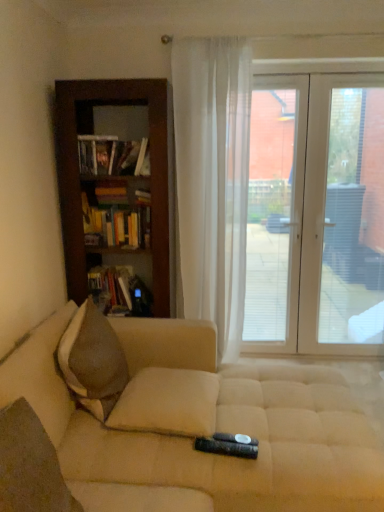
At what (x,y) coordinates should I click in order to perform the action: click on vacant space situated above hardcover books at left, which is the 2th book from top to bottom (from a real-world perspective). Please return your answer as a coordinate pair (x, y). This screenshot has width=384, height=512. Looking at the image, I should click on (119, 204).